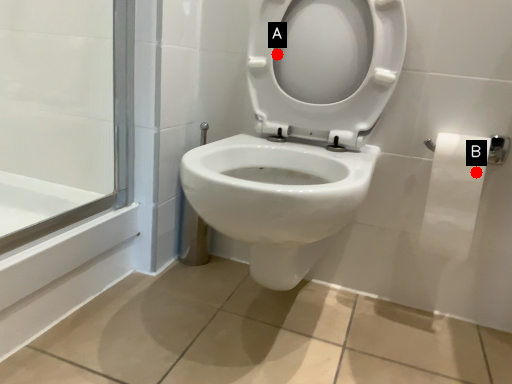
Question: Two points are circled on the image, labeled by A and B beside each circle. Among these points, which one is farthest from the camera?

Choices:
 (A) A is further
 (B) B is further

Answer: (A)